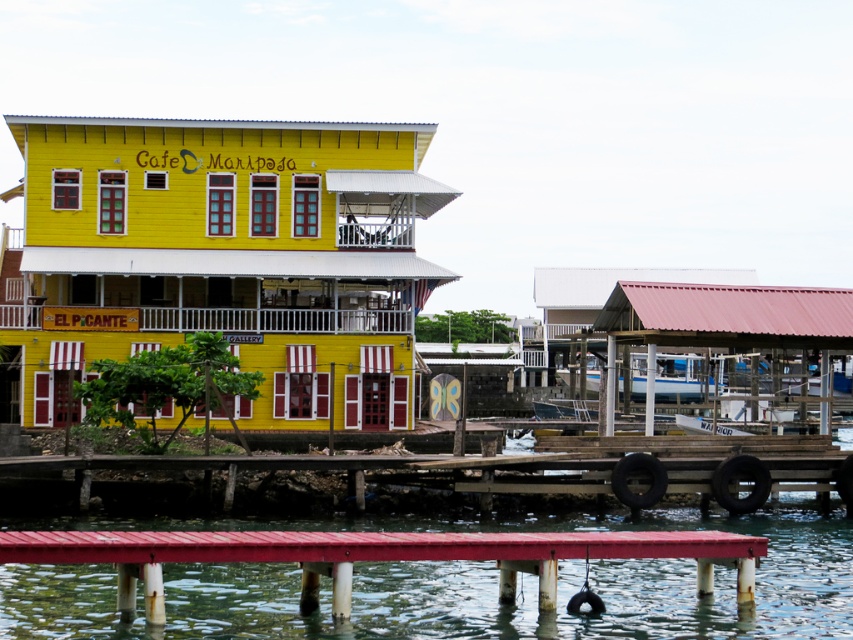
Is point (799, 632) positioned before point (718, 384)?

Yes, it is.

Does point (799, 544) come in front of point (646, 358)?

Yes.

In order to click on smooth water at lower center in this screenshot , I will do `click(456, 586)`.